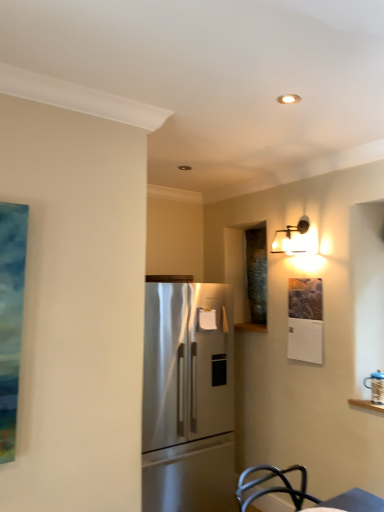
In order to face matte black sconce at upper right, should I rotate leftwards or rightwards?

Rotate your view right by about 13.021°.

The height and width of the screenshot is (512, 384). Describe the element at coordinates (292, 238) in the screenshot. I see `matte black sconce at upper right` at that location.

Where is `matte black sconce at upper right`? The height and width of the screenshot is (512, 384). matte black sconce at upper right is located at coordinates (292, 238).

The height and width of the screenshot is (512, 384). I want to click on satin stainless steel refrigerator at center, so click(x=188, y=398).

What do you see at coordinates (188, 398) in the screenshot?
I see `satin stainless steel refrigerator at center` at bounding box center [188, 398].

This screenshot has width=384, height=512. In order to click on matte black sconce at upper right in this screenshot , I will do `click(292, 238)`.

From the picture: In the image, is satin stainless steel refrigerator at center on the left side or the right side of matte black sconce at upper right?

In the image, satin stainless steel refrigerator at center appears on the left side of matte black sconce at upper right.

Is satin stainless steel refrigerator at center further to the viewer compared to matte black sconce at upper right?

No, satin stainless steel refrigerator at center is in front of matte black sconce at upper right.

Considering the points (160, 388) and (302, 227), which point is in front, point (160, 388) or point (302, 227)?

Point (302, 227)

From the image's perspective, does satin stainless steel refrigerator at center appear lower than matte black sconce at upper right?

Yes, from the image's perspective, satin stainless steel refrigerator at center is below matte black sconce at upper right.

From a real-world perspective, between satin stainless steel refrigerator at center and matte black sconce at upper right, who is vertically higher?

In real-world perspective, matte black sconce at upper right is above.

Which of these two, satin stainless steel refrigerator at center or matte black sconce at upper right, is wider?

satin stainless steel refrigerator at center is wider.

Considering the sizes of objects satin stainless steel refrigerator at center and matte black sconce at upper right in the image provided, who is shorter, satin stainless steel refrigerator at center or matte black sconce at upper right?

matte black sconce at upper right is shorter.

Considering the sizes of objects satin stainless steel refrigerator at center and matte black sconce at upper right in the image provided, who is smaller, satin stainless steel refrigerator at center or matte black sconce at upper right?

Smaller between the two is matte black sconce at upper right.

Choose the correct answer: Is satin stainless steel refrigerator at center inside matte black sconce at upper right or outside it?

satin stainless steel refrigerator at center cannot be found inside matte black sconce at upper right.

Is satin stainless steel refrigerator at center far away from matte black sconce at upper right?

Yes, satin stainless steel refrigerator at center is far from matte black sconce at upper right.

Could you tell me if satin stainless steel refrigerator at center is turned towards matte black sconce at upper right?

No, satin stainless steel refrigerator at center is not turned towards matte black sconce at upper right.

This screenshot has height=512, width=384. Identify the location of refrigerator below the matte black sconce at upper right (from the image's perspective). (188, 398).

Between matte black sconce at upper right and satin stainless steel refrigerator at center, which one appears on the left side from the viewer's perspective?

satin stainless steel refrigerator at center.

From the picture: Is the position of matte black sconce at upper right less distant than that of satin stainless steel refrigerator at center?

No, it is behind satin stainless steel refrigerator at center.

Does point (281, 251) appear closer or farther from the camera than point (150, 497)?

Point (281, 251) appears to be farther away from the viewer than point (150, 497).

From the image's perspective, is matte black sconce at upper right beneath satin stainless steel refrigerator at center?

No, from the image's perspective, matte black sconce at upper right is not beneath satin stainless steel refrigerator at center.

From a real-world perspective, who is located higher, matte black sconce at upper right or satin stainless steel refrigerator at center?

matte black sconce at upper right.

Considering the sizes of matte black sconce at upper right and satin stainless steel refrigerator at center in the image, is matte black sconce at upper right wider or thinner than satin stainless steel refrigerator at center?

Considering their sizes, matte black sconce at upper right looks slimmer than satin stainless steel refrigerator at center.

Considering the relative sizes of matte black sconce at upper right and satin stainless steel refrigerator at center in the image provided, is matte black sconce at upper right shorter than satin stainless steel refrigerator at center?

Yes, matte black sconce at upper right is shorter than satin stainless steel refrigerator at center.

Considering the relative sizes of matte black sconce at upper right and satin stainless steel refrigerator at center in the image provided, is matte black sconce at upper right bigger than satin stainless steel refrigerator at center?

No.

Does matte black sconce at upper right contain satin stainless steel refrigerator at center?

Actually, satin stainless steel refrigerator at center is outside matte black sconce at upper right.

Are matte black sconce at upper right and satin stainless steel refrigerator at center far apart?

That's right, there is a large distance between matte black sconce at upper right and satin stainless steel refrigerator at center.

Could you tell me if matte black sconce at upper right is turned towards satin stainless steel refrigerator at center?

No, matte black sconce at upper right is not oriented towards satin stainless steel refrigerator at center.

You are a GUI agent. You are given a task and a screenshot of the screen. Output one action in this format:
    pyautogui.click(x=<x>, y=<y>)
    Task: Click on the refrigerator below the matte black sconce at upper right (from a real-world perspective)
    
    Given the screenshot: What is the action you would take?
    pyautogui.click(x=188, y=398)

Find the location of a particular element. light fixture behind the satin stainless steel refrigerator at center is located at coordinates [x=292, y=238].

You are a GUI agent. You are given a task and a screenshot of the screen. Output one action in this format:
    pyautogui.click(x=<x>, y=<y>)
    Task: Click on the light fixture above the satin stainless steel refrigerator at center (from the image's perspective)
    The width and height of the screenshot is (384, 512).
    Given the screenshot: What is the action you would take?
    pyautogui.click(x=292, y=238)